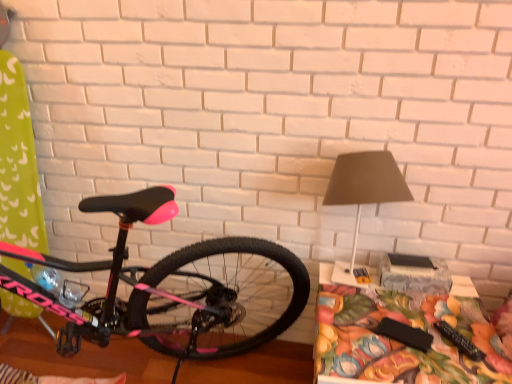
The image size is (512, 384). What are the coordinates of `free space in front of matte gray lampshade at upper right` in the screenshot? It's located at (370, 334).